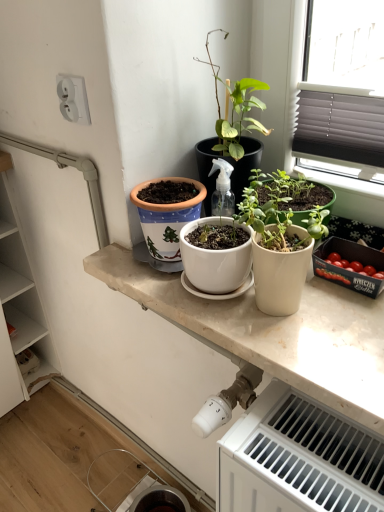
Question: From a real-world perspective, is white matte pot at center physically located above or below white glossy countertop at center?

Choices:
 (A) above
 (B) below

Answer: (A)

Question: Is white matte pot at center bigger or smaller than white glossy countertop at center?

Choices:
 (A) small
 (B) big

Answer: (A)

Question: Considering the real-world distances, which object is closest to the white glossy countertop at center?

Choices:
 (A) terracotta clay pot at center
 (B) white plastic socket at upper left
 (C) white plastic radiator at lower right
 (D) white matte cabinet at left
 (E) white matte pot at center

Answer: (E)

Question: Which of these objects is positioned closest to the terracotta clay pot at center?

Choices:
 (A) white matte cabinet at left
 (B) white plastic radiator at lower right
 (C) white plastic socket at upper left
 (D) white matte pot at center
 (E) green matte plant at center

Answer: (D)